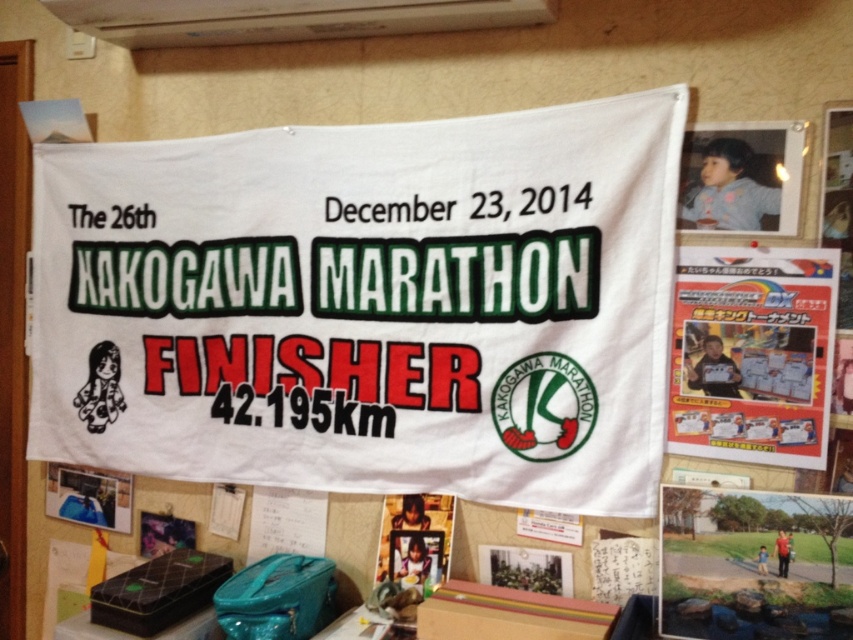
Question: Which of these objects is positioned closest to the white paper at center?

Choices:
 (A) white fabric banner at center
 (B) matte white photo frame at center
 (C) white fabric banner at upper center
 (D) white paper poster at center

Answer: (A)

Question: Which of the following is the closest to the observer?

Choices:
 (A) white fabric banner at upper center
 (B) white paper poster at center

Answer: (A)

Question: Based on their relative distances, which object is nearer to the white paper poster at center?

Choices:
 (A) white paper at center
 (B) white fabric banner at upper center
 (C) white fabric banner at center
 (D) matte white photo frame at center

Answer: (D)

Question: Does white paper poster at upper right have a lesser width compared to white fabric banner at upper center?

Choices:
 (A) yes
 (B) no

Answer: (A)

Question: Does white fabric banner at center appear on the right side of white paper at center?

Choices:
 (A) no
 (B) yes

Answer: (B)

Question: Is white paper poster at upper right to the right of white paper at center from the viewer's perspective?

Choices:
 (A) no
 (B) yes

Answer: (B)